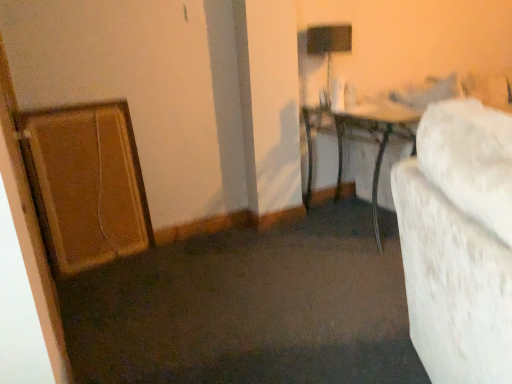
Question: Considering the relative positions of metallic silver table at center and black matte table lamp at upper center in the image provided, is metallic silver table at center to the left or to the right of black matte table lamp at upper center?

Choices:
 (A) left
 (B) right

Answer: (B)

Question: From the image's perspective, is metallic silver table at center located above or below black matte table lamp at upper center?

Choices:
 (A) below
 (B) above

Answer: (A)

Question: In terms of size, does metallic silver table at center appear bigger or smaller than black matte table lamp at upper center?

Choices:
 (A) big
 (B) small

Answer: (A)

Question: Which is correct: black matte table lamp at upper center is inside metallic silver table at center, or outside of it?

Choices:
 (A) inside
 (B) outside

Answer: (B)

Question: From a real-world perspective, is black matte table lamp at upper center positioned above or below metallic silver table at center?

Choices:
 (A) below
 (B) above

Answer: (B)

Question: Would you say black matte table lamp at upper center is to the left or to the right of metallic silver table at center in the picture?

Choices:
 (A) left
 (B) right

Answer: (A)

Question: Is point (315, 46) positioned closer to the camera than point (368, 122)?

Choices:
 (A) closer
 (B) farther

Answer: (B)